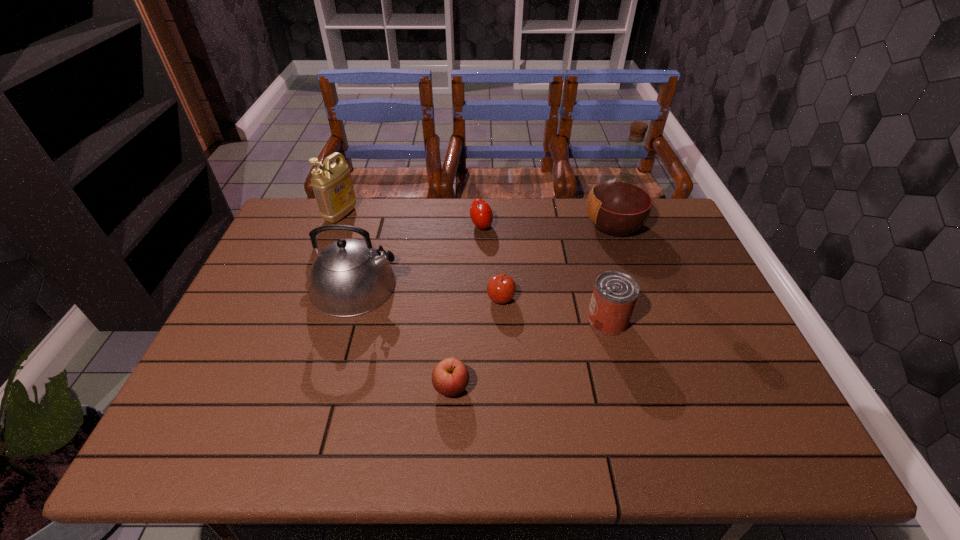
Identify the location of empty space that is in between the farthest apple and the fourth shortest object. Image resolution: width=960 pixels, height=540 pixels. (544, 273).

This screenshot has width=960, height=540. Identify the location of vacant space in between the can and the kettle. (481, 303).

Find the location of a particular element. This screenshot has height=540, width=960. free space that is in between the nearest apple and the farthest apple is located at coordinates (467, 306).

Identify the location of vacant point located between the tallest object and the second nearest apple. This screenshot has width=960, height=540. (558, 261).

You are a GUI agent. You are given a task and a screenshot of the screen. Output one action in this format:
    pyautogui.click(x=<x>, y=<y>)
    Task: Click on the vacant area that lies between the nearest apple and the kettle
    
    Given the screenshot: What is the action you would take?
    pyautogui.click(x=403, y=336)

Locate an element on the screen. The height and width of the screenshot is (540, 960). free space between the kettle and the fourth shortest object is located at coordinates (481, 303).

Identify the location of the sixth closest object relative to the detergent. [x=615, y=293].

The height and width of the screenshot is (540, 960). What are the coordinates of `the third closest object relative to the detergent` in the screenshot? It's located at (501, 288).

Identify which apple is located as the nearest to the kettle. Please provide its 2D coordinates. Your answer should be formatted as a tuple, i.e. [(x, y)], where the tuple contains the x and y coordinates of a point satisfying the conditions above.

[(450, 377)]

Select which apple is the closest to the detergent. Please provide its 2D coordinates. Your answer should be formatted as a tuple, i.e. [(x, y)], where the tuple contains the x and y coordinates of a point satisfying the conditions above.

[(481, 214)]